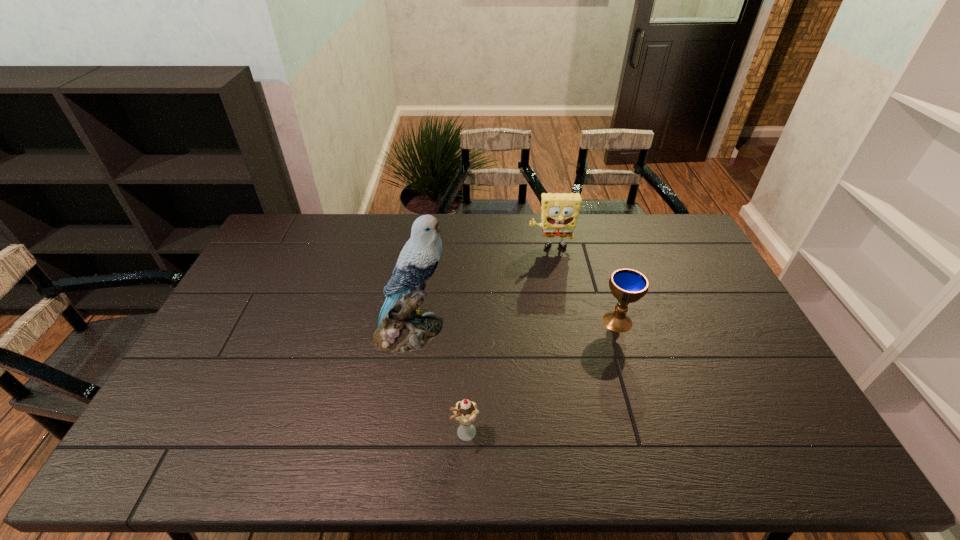
The image size is (960, 540). What are the coordinates of `vacant area in the image that satisfies the following two spatial constraints: 1. on the face of the farthest object; 2. on the face of the tallest object` in the screenshot? It's located at (566, 330).